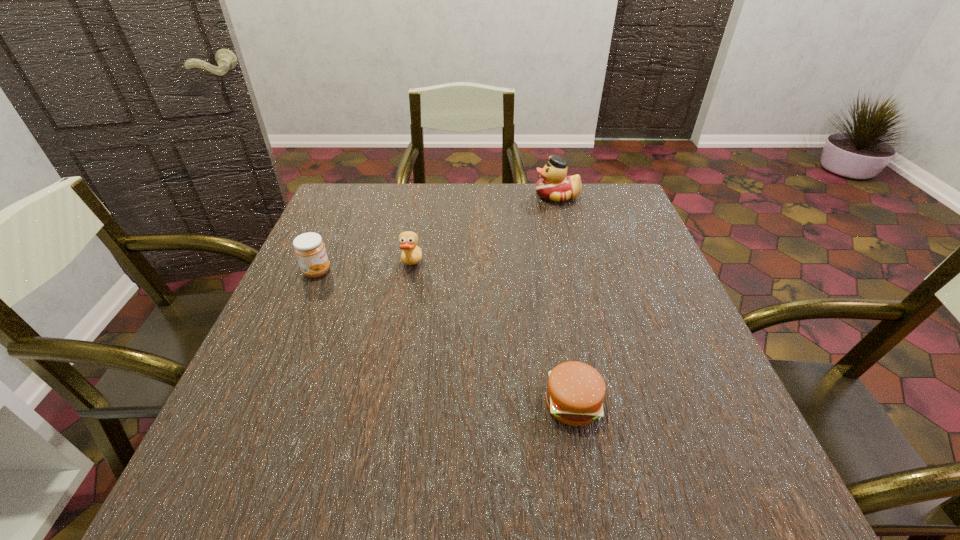
I want to click on the tallest object, so click(x=554, y=185).

This screenshot has width=960, height=540. In order to click on the taller duck in this screenshot , I will do `click(554, 185)`.

Identify the location of the third object from right to left. (411, 254).

Locate an element on the screen. The image size is (960, 540). the left duck is located at coordinates (411, 254).

Locate an element on the screen. the leftmost object is located at coordinates (309, 248).

This screenshot has width=960, height=540. I want to click on hamburger, so click(x=575, y=392).

The image size is (960, 540). Find the location of `the shortest object`. the shortest object is located at coordinates (575, 392).

The width and height of the screenshot is (960, 540). I want to click on free space located on the face of the taller duck, so click(497, 196).

Where is `vacant area situated 0.230m on the face of the taller duck`? vacant area situated 0.230m on the face of the taller duck is located at coordinates (457, 196).

Where is `vacant position located 0.220m on the face of the taller duck`? This screenshot has width=960, height=540. vacant position located 0.220m on the face of the taller duck is located at coordinates (461, 196).